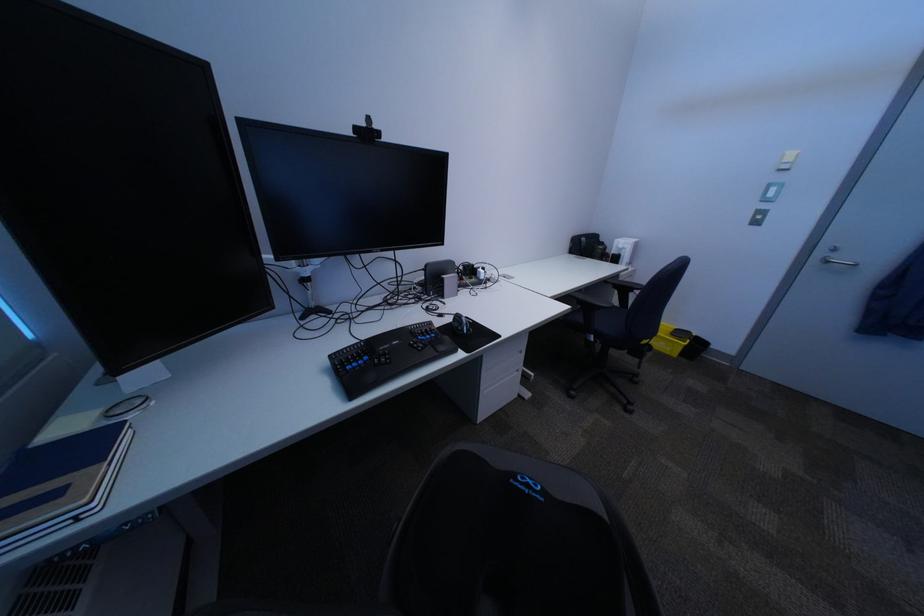
The width and height of the screenshot is (924, 616). Describe the element at coordinates (506, 541) in the screenshot. I see `the chair sitting surface` at that location.